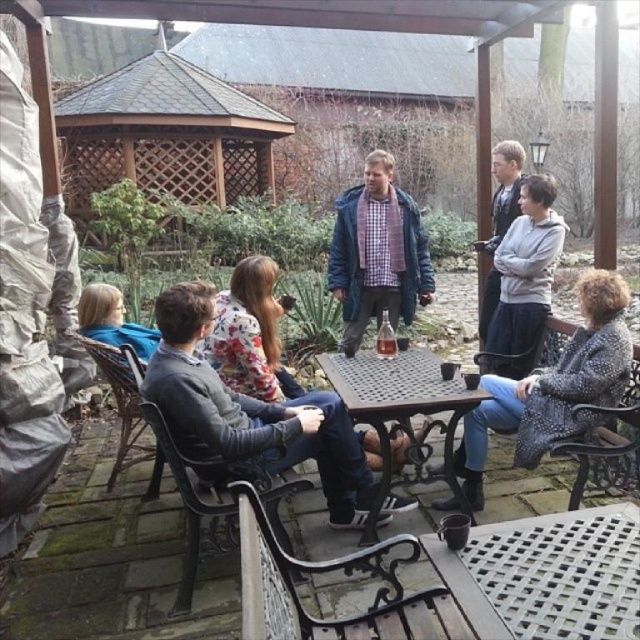
Who is lower down, gray fleece jacket at upper right or light brown hair at lower left?

Positioned lower is light brown hair at lower left.

Is the position of gray fleece jacket at upper right more distant than that of light brown hair at lower left?

Yes, gray fleece jacket at upper right is behind light brown hair at lower left.

Between point (499, 241) and point (83, 330), which one is positioned in front?

Point (83, 330)

Where is `gray fleece jacket at upper right`? gray fleece jacket at upper right is located at coordinates (502, 192).

From the picture: Is gray fabric jacket at center to the right of light brown hair at lower left from the viewer's perspective?

Yes, gray fabric jacket at center is to the right of light brown hair at lower left.

Does point (310, 429) come in front of point (108, 339)?

Yes, it is.

You are a GUI agent. You are given a task and a screenshot of the screen. Output one action in this format:
    pyautogui.click(x=<x>, y=<y>)
    Task: Click on the gray fabric jacket at center
    
    Given the screenshot: What is the action you would take?
    pyautogui.click(x=248, y=413)

Based on the photo, is light gray sweatshirt at upper right to the right of light brown hair at lower left from the viewer's perspective?

Indeed, light gray sweatshirt at upper right is positioned on the right side of light brown hair at lower left.

Which is below, light gray sweatshirt at upper right or light brown hair at lower left?

light brown hair at lower left is lower down.

Which is behind, point (524, 234) or point (129, 323)?

The point (129, 323) is behind.

Where is `light gray sweatshirt at upper right`? The image size is (640, 640). light gray sweatshirt at upper right is located at coordinates (524, 278).